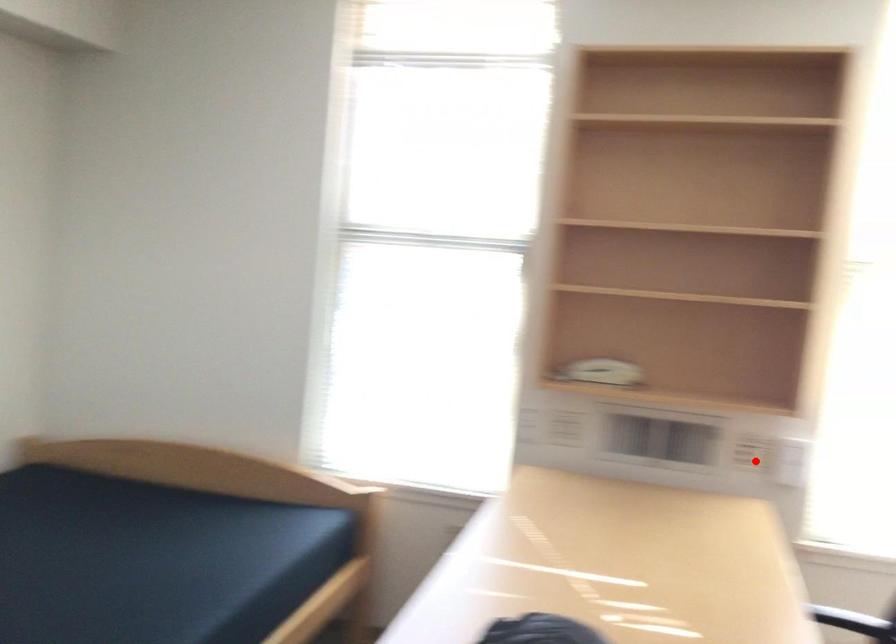
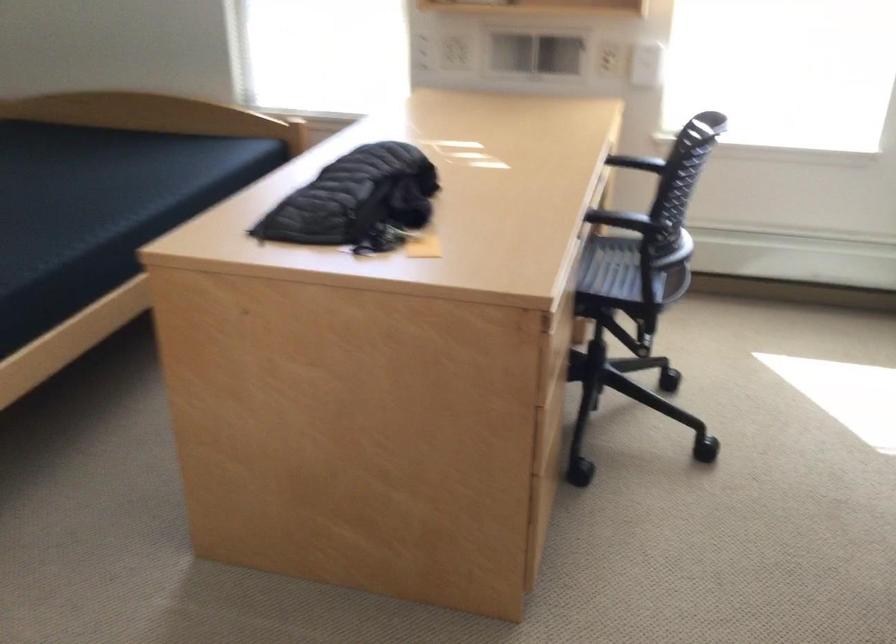
Find the pixel in the second image that matches the highlighted location in the first image.

(616, 62)